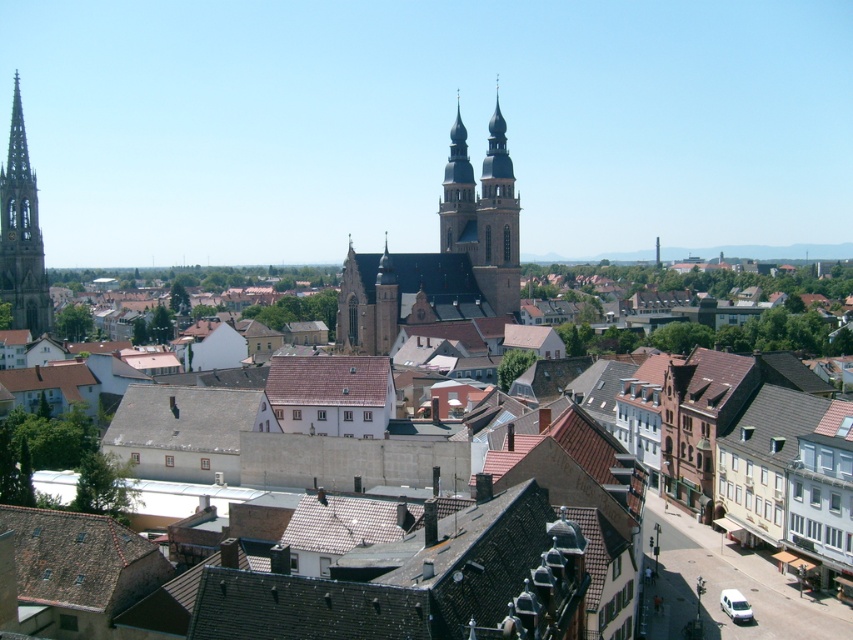
Between gray slate roof at center and smooth gray stone tower at left, which one has less height?

With less height is gray slate roof at center.

Based on the photo, is gray slate roof at center bigger than smooth gray stone tower at left?

No, gray slate roof at center is not bigger than smooth gray stone tower at left.

What do you see at coordinates (186, 419) in the screenshot?
I see `gray slate roof at center` at bounding box center [186, 419].

Locate an element on the screen. The width and height of the screenshot is (853, 640). gray slate roof at center is located at coordinates (186, 419).

Can you confirm if brown tile roof at lower left is bigger than smooth gray stone tower at left?

No, brown tile roof at lower left is not bigger than smooth gray stone tower at left.

Which is below, brown tile roof at lower left or smooth gray stone tower at left?

brown tile roof at lower left is lower down.

Locate an element on the screen. brown tile roof at lower left is located at coordinates (80, 560).

In the scene shown: Is smooth gray stone tower at left closer to the viewer compared to brown tile roof at center?

No, smooth gray stone tower at left is behind brown tile roof at center.

Based on the photo, can you confirm if smooth gray stone tower at left is bigger than brown tile roof at center?

Yes.

This screenshot has width=853, height=640. In order to click on smooth gray stone tower at left in this screenshot , I will do `click(21, 234)`.